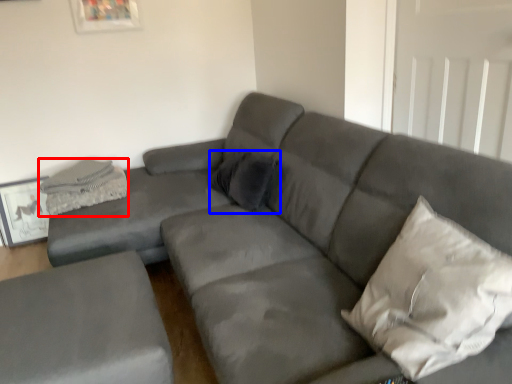
Question: Which object is further to the camera taking this photo, material (highlighted by a red box) or pillow (highlighted by a blue box)?

Choices:
 (A) material
 (B) pillow

Answer: (A)